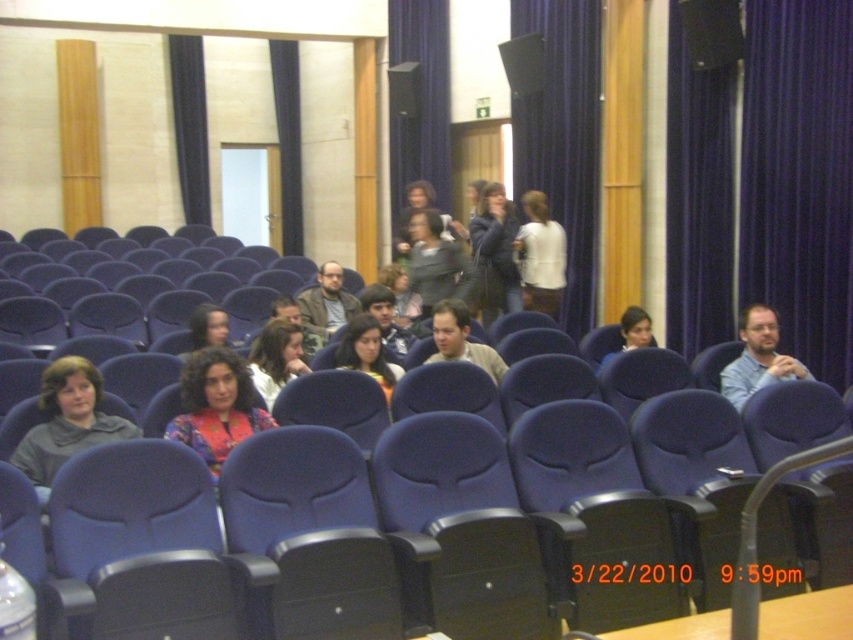
Does purple fabric curtain at upper center have a lesser width compared to matte black hair at center?

In fact, purple fabric curtain at upper center might be wider than matte black hair at center.

Based on the photo, between purple fabric curtain at upper center and matte black hair at center, which one appears on the right side from the viewer's perspective?

From the viewer's perspective, purple fabric curtain at upper center appears more on the right side.

Is point (590, 150) positioned behind point (225, 314)?

That is True.

Identify the location of purple fabric curtain at upper center. Image resolution: width=853 pixels, height=640 pixels. (563, 138).

Between blue fabric curtain at upper center and matte blue chair at center, which one is positioned higher?

blue fabric curtain at upper center is higher up.

Does point (434, 26) come closer to viewer compared to point (376, 321)?

No, it is behind (376, 321).

You are a GUI agent. You are given a task and a screenshot of the screen. Output one action in this format:
    pyautogui.click(x=<x>, y=<y>)
    Task: Click on the blue fabric curtain at upper center
    This screenshot has width=853, height=640.
    Given the screenshot: What is the action you would take?
    pyautogui.click(x=418, y=108)

Can you confirm if blue fabric chair at right is smaller than matte gray scarf at upper center?

Indeed, blue fabric chair at right has a smaller size compared to matte gray scarf at upper center.

From the picture: Can you confirm if blue fabric chair at right is shorter than matte gray scarf at upper center?

Incorrect, blue fabric chair at right's height does not fall short of matte gray scarf at upper center's.

Identify the location of blue fabric chair at right. (758, 356).

Locate an element on the screen. blue fabric chair at right is located at coordinates (758, 356).